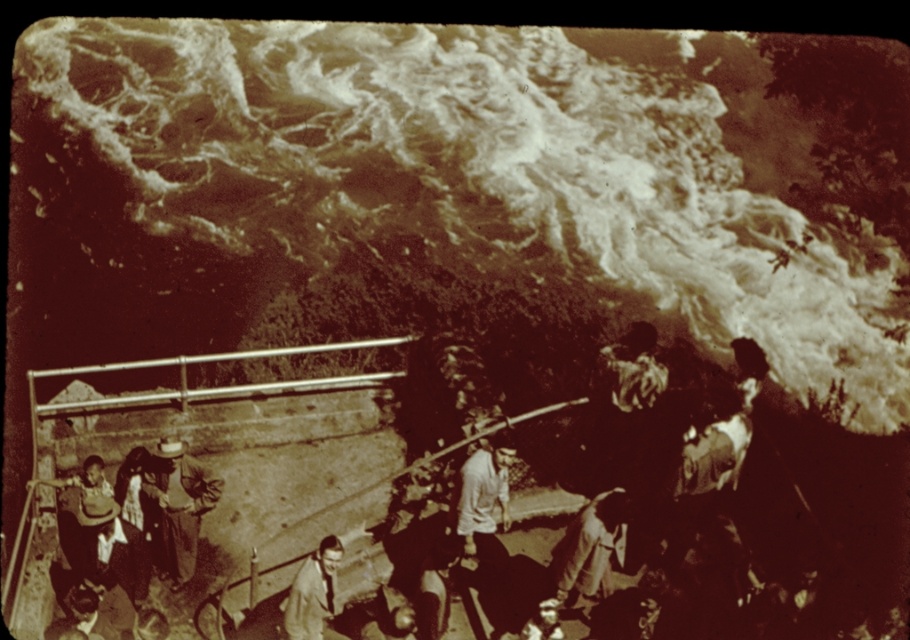
You are a photographer trying to capture the waterfall scene. You notice two light brown items in the foreground. Which one is positioned higher up, the light brown fabric shirt at center or the light brown leather jacket at lower center?

The light brown fabric shirt at center is positioned higher up than the light brown leather jacket at lower center.

You are a photographer trying to capture the waterfall in the image. You notice a point at coordinates (484, 497). What object is this point located on?

The point at coordinates (484, 497) is located on the light brown fabric shirt at center.

You are a photographer trying to capture a clear shot of the light brown fabric shirt at center and the light brown leather jacket at lower center. Since you want both subjects in focus, which one should you adjust your camera focus on first?

The light brown leather jacket at lower center is behind the light brown fabric shirt at center, so you should focus on the light brown leather jacket at lower center first to ensure both are in focus.